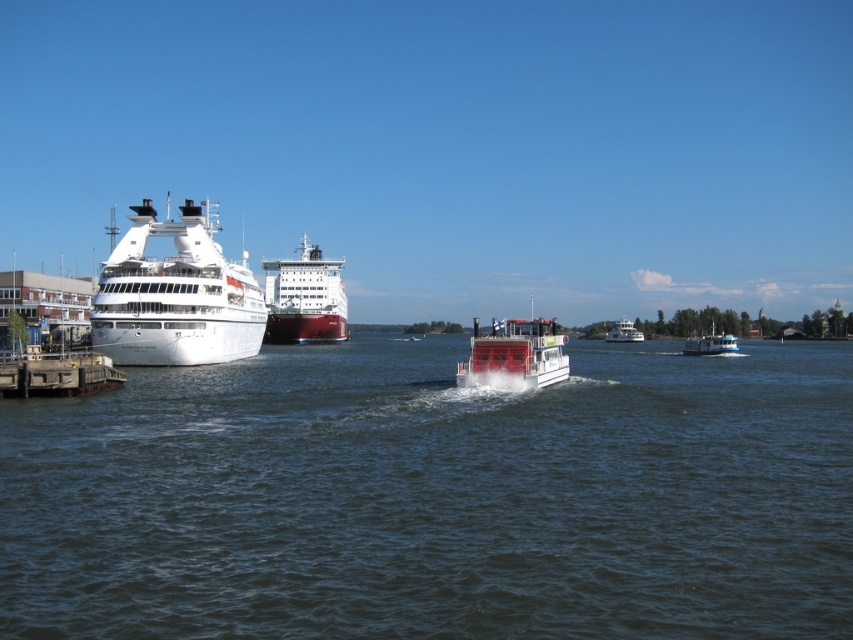
You are a harbor pilot navigating a new ship into the harbor. You see the white glossy cruise ship at left and the white glossy ferry at center. Which vessel should you avoid colliding with first as you approach the pier?

You should avoid colliding with the white glossy cruise ship at left first because the white glossy ferry at center is behind it, making the cruise ship closer to your approach path.

You are standing on the concrete dock at lower left and want to board the blue glossy ferry at right. Which direction should you walk to reach the ferry?

Since the concrete dock at lower left is in front of the blue glossy ferry at right, you should walk forward towards the ferry to board it.